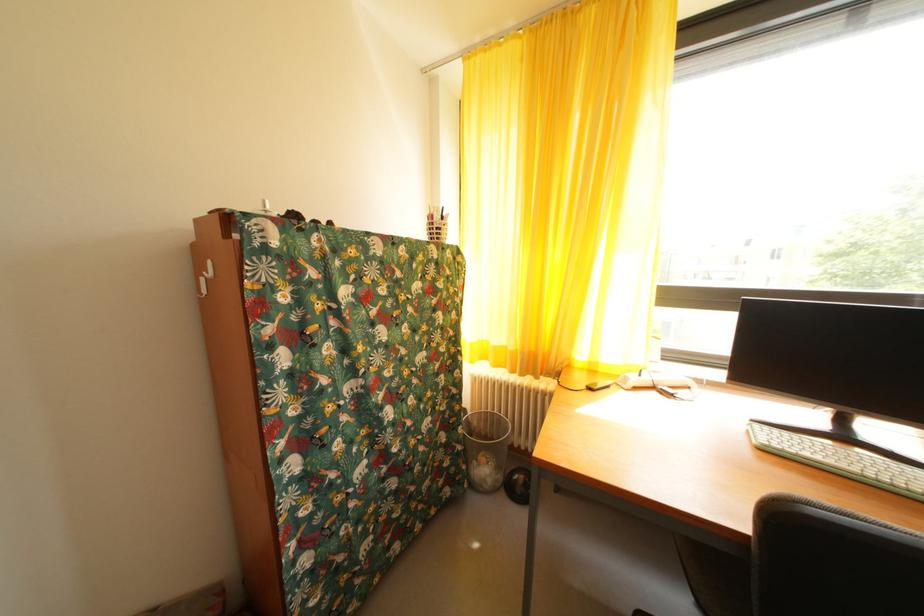
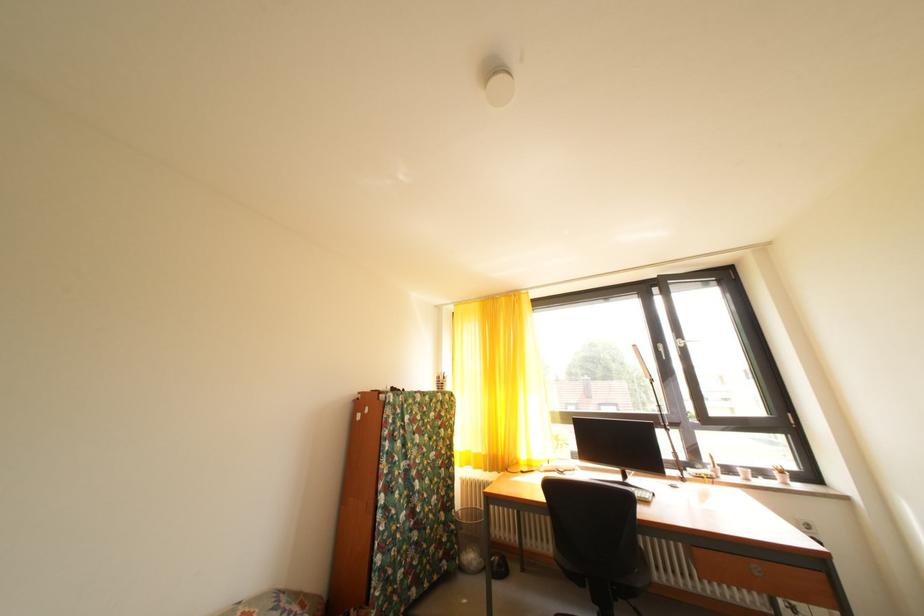
Find the pixel in the second image that matches the point at 468,454 in the first image.

(462, 533)